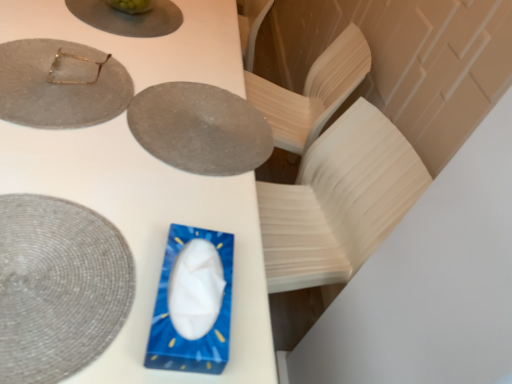
Describe the element at coordinates (149, 235) in the screenshot. This screenshot has height=384, width=512. I see `blue plastic tissue box at center` at that location.

What do you see at coordinates (77, 59) in the screenshot? I see `gold metallic glasses at upper left` at bounding box center [77, 59].

I want to click on matte gray placemat at lower left, marked as the first plate in a bottom-to-top arrangement, so click(x=58, y=287).

Where is `matte gray plate at upper center, the 4th plate positioned from the bottom`? This screenshot has width=512, height=384. matte gray plate at upper center, the 4th plate positioned from the bottom is located at coordinates (128, 18).

Could you tell me if matte gray plate at upper center, placed as the third plate when sorted from top to bottom, is facing gold metallic glasses at upper left?

No, matte gray plate at upper center, placed as the third plate when sorted from top to bottom, does not turn towards gold metallic glasses at upper left.

Is matte gray plate at upper center, placed as the third plate when sorted from top to bottom, not near gold metallic glasses at upper left?

matte gray plate at upper center, placed as the third plate when sorted from top to bottom, is actually quite close to gold metallic glasses at upper left.

Which object is closer to the camera, matte gray plate at upper center, the second plate positioned from the bottom, or gold metallic glasses at upper left?

matte gray plate at upper center, the second plate positioned from the bottom.

Consider the image. Does matte gray plate at upper center, the second plate positioned from the bottom, have a smaller size compared to gold metallic glasses at upper left?

No.

Identify the location of the 2nd plate behind the matte gray placemat at upper left, which appears as the third plate when ordered from the bottom. The height and width of the screenshot is (384, 512). (128, 18).

Is matte gray placemat at upper left, which appears as the third plate when ordered from the bottom, turned away from matte gray plate at upper center, positioned as the 1th plate in top-to-bottom order?

No, matte gray plate at upper center, positioned as the 1th plate in top-to-bottom order, is not at the back of matte gray placemat at upper left, which appears as the third plate when ordered from the bottom.

From the picture: Considering the relative sizes of matte gray placemat at upper left, acting as the 2th plate starting from the top, and matte gray plate at upper center, the 4th plate positioned from the bottom, in the image provided, is matte gray placemat at upper left, acting as the 2th plate starting from the top, bigger than matte gray plate at upper center, the 4th plate positioned from the bottom,?

Yes, matte gray placemat at upper left, acting as the 2th plate starting from the top, is bigger than matte gray plate at upper center, the 4th plate positioned from the bottom.

Which is more to the right, matte gray placemat at upper left, which appears as the third plate when ordered from the bottom, or matte gray plate at upper center, positioned as the 1th plate in top-to-bottom order?

matte gray plate at upper center, positioned as the 1th plate in top-to-bottom order.

Which object is thinner, blue plastic tissue box at center or matte gray plate at upper center, placed as the third plate when sorted from top to bottom?

With smaller width is matte gray plate at upper center, placed as the third plate when sorted from top to bottom.

Who is more distant, blue plastic tissue box at center or matte gray plate at upper center, placed as the third plate when sorted from top to bottom?

matte gray plate at upper center, placed as the third plate when sorted from top to bottom, is further from the camera.

What's the angular difference between blue plastic tissue box at center and matte gray plate at upper center, the second plate positioned from the bottom,'s facing directions?

The angular difference between blue plastic tissue box at center and matte gray plate at upper center, the second plate positioned from the bottom, is 178 degrees.

This screenshot has height=384, width=512. I want to click on table that appears above the matte gray plate at upper center, placed as the third plate when sorted from top to bottom (from the image's perspective), so click(149, 235).

From a real-world perspective, which plate is the 3rd one underneath the matte gray placemat at upper left, acting as the 2th plate starting from the top? Please provide its 2D coordinates.

[(200, 128)]

How many degrees apart are the facing directions of matte gray plate at upper center, the second plate positioned from the bottom, and matte gray placemat at upper left, acting as the 2th plate starting from the top?

The angle between the facing direction of matte gray plate at upper center, the second plate positioned from the bottom, and the facing direction of matte gray placemat at upper left, acting as the 2th plate starting from the top, is 178 degrees.

Looking at this image, who is taller, matte gray plate at upper center, the second plate positioned from the bottom, or matte gray placemat at upper left, which appears as the third plate when ordered from the bottom?

Standing taller between the two is matte gray plate at upper center, the second plate positioned from the bottom.

Considering the points (140, 122) and (26, 101), which point is behind, point (140, 122) or point (26, 101)?

The point (140, 122) is farther.

Is matte gray placemat at upper left, which appears as the third plate when ordered from the bottom, inside or outside of matte gray plate at upper center, placed as the third plate when sorted from top to bottom?

matte gray placemat at upper left, which appears as the third plate when ordered from the bottom, exists outside the volume of matte gray plate at upper center, placed as the third plate when sorted from top to bottom.

In the scene shown: Is matte gray placemat at upper left, acting as the 2th plate starting from the top, bigger than matte gray plate at upper center, placed as the third plate when sorted from top to bottom?

Yes.

Is matte gray placemat at upper left, which appears as the third plate when ordered from the bottom, in contact with matte gray plate at upper center, the second plate positioned from the bottom?

No, matte gray placemat at upper left, which appears as the third plate when ordered from the bottom, is not with matte gray plate at upper center, the second plate positioned from the bottom.

How different are the orientations of matte gray placemat at upper left, which appears as the third plate when ordered from the bottom, and matte gray plate at upper center, the second plate positioned from the bottom, in degrees?

matte gray placemat at upper left, which appears as the third plate when ordered from the bottom, and matte gray plate at upper center, the second plate positioned from the bottom, are facing 178 degrees away from each other.

Does matte gray placemat at upper left, acting as the 2th plate starting from the top, have a larger size compared to blue plastic tissue box at center?

No.

Could you tell me if matte gray placemat at upper left, acting as the 2th plate starting from the top, is turned towards blue plastic tissue box at center?

Yes.

Between matte gray placemat at upper left, acting as the 2th plate starting from the top, and blue plastic tissue box at center, which one has smaller width?

With smaller width is matte gray placemat at upper left, acting as the 2th plate starting from the top.

Is matte gray placemat at upper left, acting as the 2th plate starting from the top, taller than blue plastic tissue box at center?

In fact, matte gray placemat at upper left, acting as the 2th plate starting from the top, may be shorter than blue plastic tissue box at center.

Is blue plastic tissue box at center facing towards matte gray placemat at lower left, arranged as the 4th plate when viewed from the top?

No, blue plastic tissue box at center is not aimed at matte gray placemat at lower left, arranged as the 4th plate when viewed from the top.

What's the angular difference between blue plastic tissue box at center and matte gray placemat at lower left, marked as the first plate in a bottom-to-top arrangement,'s facing directions?

85.2 degrees separate the facing orientations of blue plastic tissue box at center and matte gray placemat at lower left, marked as the first plate in a bottom-to-top arrangement.

At what (x,y) coordinates should I click in order to perform the action: click on table below the matte gray placemat at lower left, marked as the first plate in a bottom-to-top arrangement (from a real-world perspective). Please return your answer as a coordinate pair (x, y). This screenshot has width=512, height=384. Looking at the image, I should click on (149, 235).

The width and height of the screenshot is (512, 384). What are the coordinates of `tableware that is behind the matte gray plate at upper center, placed as the third plate when sorted from top to bottom` in the screenshot? It's located at (77, 59).

This screenshot has width=512, height=384. I want to click on plate above the matte gray placemat at upper left, which appears as the third plate when ordered from the bottom (from the image's perspective), so click(x=128, y=18).

Estimate the real-world distances between objects in this image. Which object is closer to matte gray placemat at upper left, which appears as the third plate when ordered from the bottom, matte gray plate at upper center, the second plate positioned from the bottom, or gold metallic glasses at upper left?

gold metallic glasses at upper left is positioned closer to the anchor matte gray placemat at upper left, which appears as the third plate when ordered from the bottom.

From the image, which object appears to be nearer to matte gray plate at upper center, the second plate positioned from the bottom, matte gray placemat at lower left, arranged as the 4th plate when viewed from the top, or matte gray placemat at upper left, acting as the 2th plate starting from the top?

matte gray placemat at upper left, acting as the 2th plate starting from the top, lies closer to matte gray plate at upper center, the second plate positioned from the bottom, than the other object.

Looking at the image, which one is located further to blue plastic tissue box at center, matte gray placemat at upper left, which appears as the third plate when ordered from the bottom, or matte gray plate at upper center, placed as the third plate when sorted from top to bottom?

The object further to blue plastic tissue box at center is matte gray placemat at upper left, which appears as the third plate when ordered from the bottom.

Considering their positions, is gold metallic glasses at upper left positioned closer to matte gray plate at upper center, the second plate positioned from the bottom, than matte gray placemat at lower left, marked as the first plate in a bottom-to-top arrangement?

gold metallic glasses at upper left lies closer to matte gray plate at upper center, the second plate positioned from the bottom, than the other object.

Considering their positions, is blue plastic tissue box at center positioned closer to matte gray plate at upper center, placed as the third plate when sorted from top to bottom, than matte gray placemat at upper left, acting as the 2th plate starting from the top?

Among the two, blue plastic tissue box at center is located nearer to matte gray plate at upper center, placed as the third plate when sorted from top to bottom.

Estimate the real-world distances between objects in this image. Which object is further from gold metallic glasses at upper left, matte gray plate at upper center, the second plate positioned from the bottom, or matte gray placemat at upper left, acting as the 2th plate starting from the top?

matte gray plate at upper center, the second plate positioned from the bottom.

Looking at the image, which one is located closer to matte gray plate at upper center, positioned as the 1th plate in top-to-bottom order, blue plastic tissue box at center or gold metallic glasses at upper left?

blue plastic tissue box at center.

From the image, which object appears to be farther from matte gray plate at upper center, placed as the third plate when sorted from top to bottom, gold metallic glasses at upper left or blue plastic tissue box at center?

The object further to matte gray plate at upper center, placed as the third plate when sorted from top to bottom, is gold metallic glasses at upper left.

This screenshot has width=512, height=384. What are the coordinates of `tableware between matte gray placemat at upper left, which appears as the third plate when ordered from the bottom, and matte gray plate at upper center, placed as the third plate when sorted from top to bottom, from left to right` in the screenshot? It's located at (x=77, y=59).

The height and width of the screenshot is (384, 512). I want to click on tableware between matte gray plate at upper center, the 4th plate positioned from the bottom, and matte gray plate at upper center, the second plate positioned from the bottom, in the vertical direction, so click(x=77, y=59).

The width and height of the screenshot is (512, 384). I want to click on plate that lies between matte gray plate at upper center, positioned as the 1th plate in top-to-bottom order, and matte gray plate at upper center, the second plate positioned from the bottom, from top to bottom, so click(60, 84).

Where is `tableware positioned between blue plastic tissue box at center and matte gray plate at upper center, the 4th plate positioned from the bottom, from near to far`? The height and width of the screenshot is (384, 512). tableware positioned between blue plastic tissue box at center and matte gray plate at upper center, the 4th plate positioned from the bottom, from near to far is located at coordinates (77, 59).